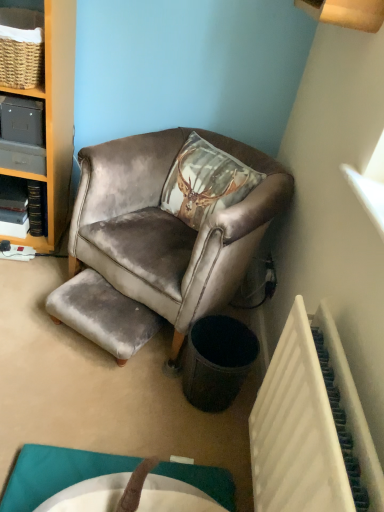
The image size is (384, 512). In order to click on vacant space in between velvet grey stool at lower left and black textured trash bin at lower right in this screenshot , I will do `click(160, 375)`.